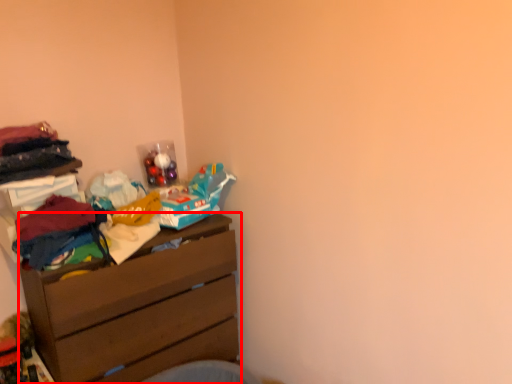
Question: From the image, what is the correct spatial relationship of chest of drawers (annotated by the red box) in relation to clothing?

Choices:
 (A) right
 (B) left

Answer: (A)